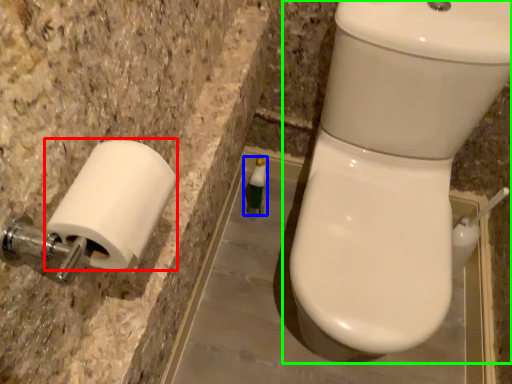
Question: Considering the real-world distances, which object is farthest from toilet paper (highlighted by a red box)? toiletry (highlighted by a blue box) or toilet (highlighted by a green box)?

Choices:
 (A) toiletry
 (B) toilet

Answer: (A)